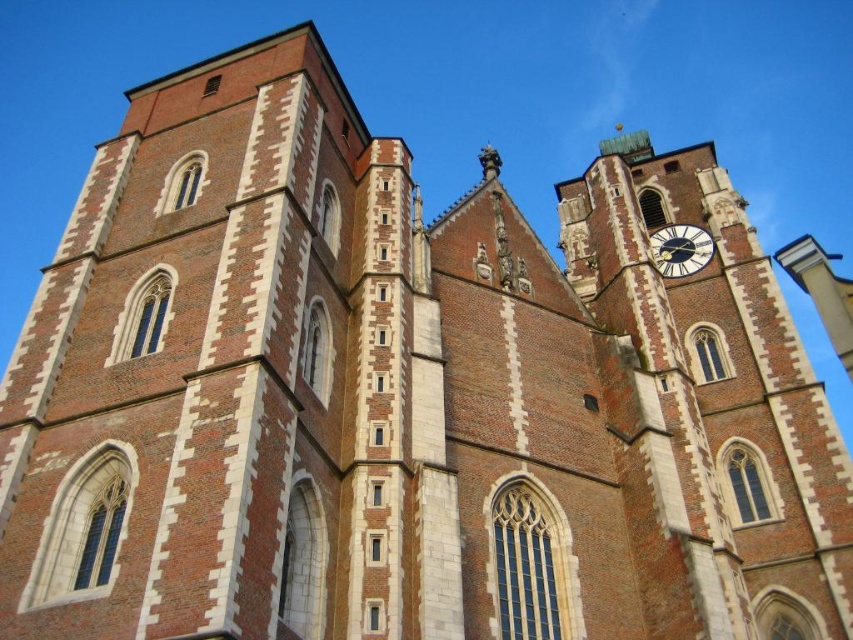
You are an architect visiting the church and want to compare the sizes of the brick and stone clock tower at center and the blue painted metal clock at upper right. Which one is wider?

The brick and stone clock tower at center is wider than the blue painted metal clock at upper right because its width surpasses the clock.

You are standing at the entrance of the historic church and want to take a photo of the brick and stone clock tower at center. If your camera can focus on objects up to 50 meters away, will it be able to capture the tower clearly?

The brick and stone clock tower at center is 50.50 meters away from the camera. Since the camera can only focus up to 50 meters, it will not be able to capture the tower clearly.